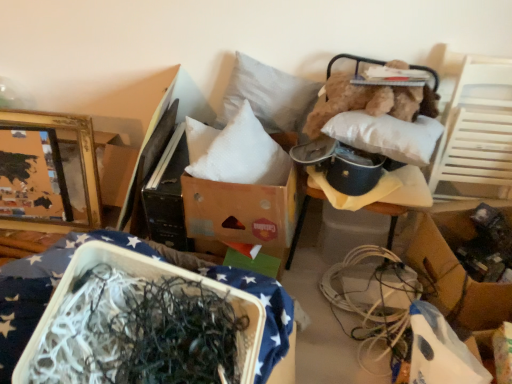
Question: From the image's perspective, relative to gold/gilded picture frame at upper left, is white fabric cushion at upper right, placed as the second furniture when sorted from front to back, above or below?

Choices:
 (A) above
 (B) below

Answer: (B)

Question: Is white fabric cushion at upper right, acting as the 1th furniture starting from the back, situated inside gold/gilded picture frame at upper left or outside?

Choices:
 (A) inside
 (B) outside

Answer: (B)

Question: Which object is the closest to the brown cardboard box at center, which appears as the first cardboard box when viewed from the top?

Choices:
 (A) fuzzy brown teddy bear at upper right
 (B) white fabric cushion at upper right, the second furniture viewed from the left
 (C) white plastic wire at lower right
 (D) white styrofoam container at lower left, which is the 2th furniture from right to left
 (E) gold/gilded picture frame at upper left

Answer: (A)

Question: Which object is the farthest from the gold/gilded picture frame at upper left?

Choices:
 (A) white fabric cushion at upper right, which ranks as the first furniture in right-to-left order
 (B) white styrofoam container at lower left, marked as the 1th furniture in a left-to-right arrangement
 (C) white plastic wire at lower right
 (D) fuzzy brown teddy bear at upper right
 (E) white soft pillow at center, acting as the first pillow starting from the left

Answer: (C)